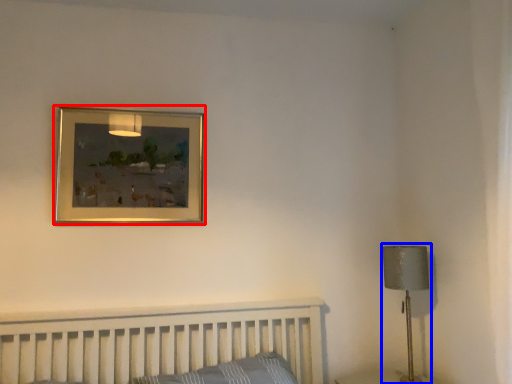
Question: Which object appears farthest to the camera in this image, picture frame (highlighted by a red box) or table lamp (highlighted by a blue box)?

Choices:
 (A) picture frame
 (B) table lamp

Answer: (A)